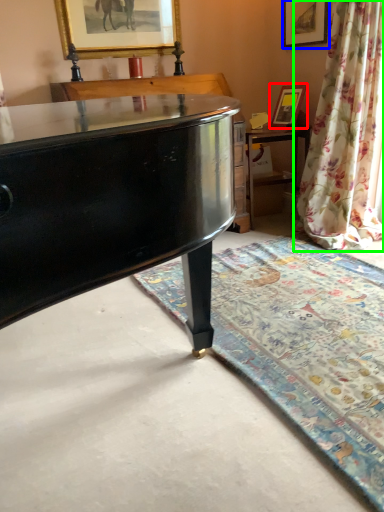
Question: Based on their relative distances, which object is farther from picture frame (highlighted by a red box)? Choose from picture frame (highlighted by a blue box) and curtain (highlighted by a green box).

Choices:
 (A) picture frame
 (B) curtain

Answer: (B)